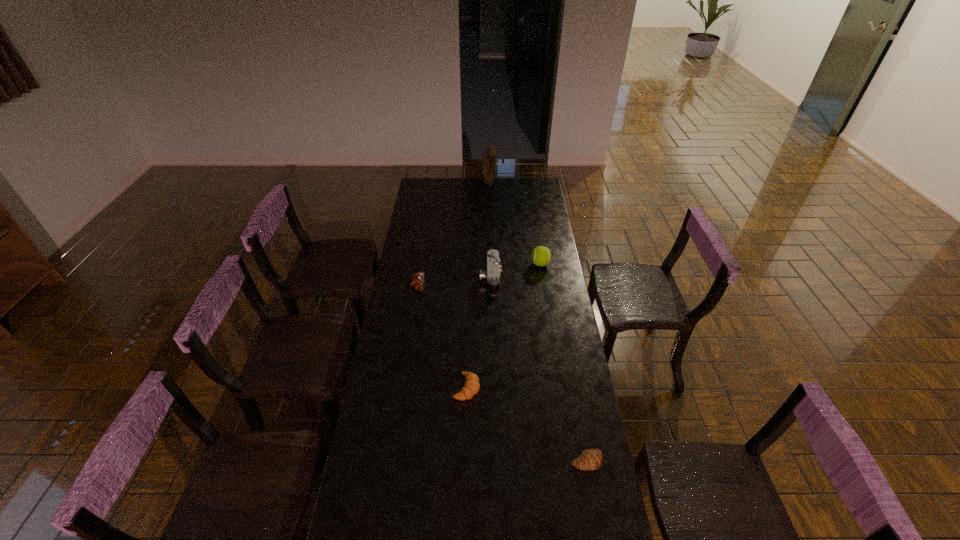
Find the location of a particular element. Image resolution: width=960 pixels, height=540 pixels. vacant space located 0.140m on the front-facing side of the tallest object is located at coordinates (490, 198).

I want to click on vacant space located 0.120m on the lens of the camera, so click(x=456, y=279).

Identify the location of vacant space situated on the lens of the camera. This screenshot has height=540, width=960. (423, 279).

Identify the location of blank space located 0.330m on the lens of the camera. (413, 279).

Where is `free spot located 0.280m on the back of the tennis ball`? Image resolution: width=960 pixels, height=540 pixels. free spot located 0.280m on the back of the tennis ball is located at coordinates (535, 226).

Where is `free region located 0.250m on the left of the second nearest crescent roll`? This screenshot has height=540, width=960. free region located 0.250m on the left of the second nearest crescent roll is located at coordinates (389, 388).

Where is `free space located 0.340m on the back of the farthest crescent roll`? free space located 0.340m on the back of the farthest crescent roll is located at coordinates (425, 234).

Find the location of `free space located 0.220m on the left of the rightmost crescent roll`. free space located 0.220m on the left of the rightmost crescent roll is located at coordinates (506, 461).

Locate an element on the screen. This screenshot has width=960, height=540. object located at the far edge is located at coordinates (489, 156).

The width and height of the screenshot is (960, 540). I want to click on object located at the left edge, so click(x=417, y=279).